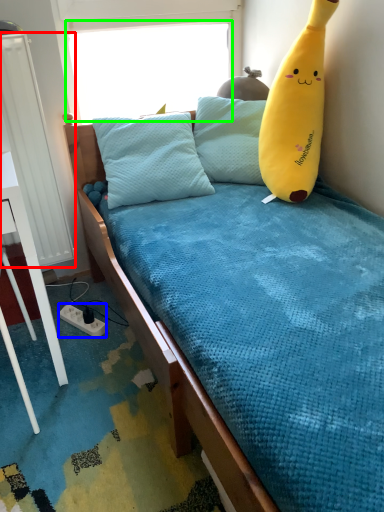
Question: Which is farther away from radiator (highlighted by a red box)? power outlet (highlighted by a blue box) or window screen (highlighted by a green box)?

Choices:
 (A) power outlet
 (B) window screen

Answer: (B)